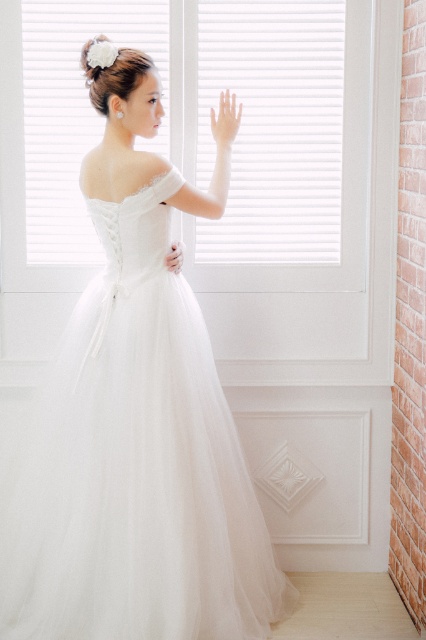
You are standing in the room and want to look outside through the white matte window at center. Where should you position yourself to see the window clearly?

To see the white matte window at center clearly, you should position yourself directly in front of the window since it is located at the central point of the room.

You are standing in the room where the wedding gown is being modeled. You need to place a small table exactly 3 meters away from the point marked at coordinate point (328, 250). Is the space sufficient to place the table there?

The distance between point (328, 250) and the viewer is 3.20 meters, so placing a table 3 meters away from that point is feasible as it is within the available space.